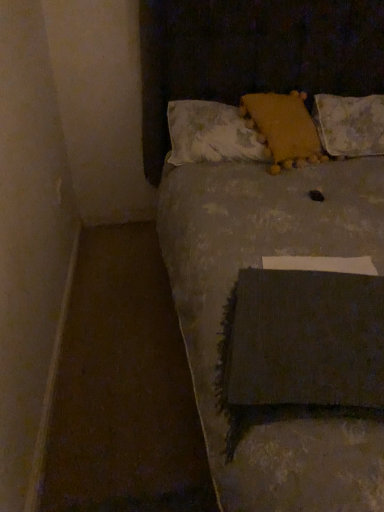
Question: From the image's perspective, would you say white textured pillow at upper right, the first pillow from the right, is shown under yellow fuzzy pillow at upper center, the second pillow when ordered from left to right?

Choices:
 (A) no
 (B) yes

Answer: (A)

Question: Is white textured pillow at upper right, the first pillow from the right, looking in the opposite direction of yellow fuzzy pillow at upper center, acting as the second pillow starting from the right?

Choices:
 (A) yes
 (B) no

Answer: (B)

Question: Is white textured pillow at upper right, the first pillow from the right, next to yellow fuzzy pillow at upper center, acting as the second pillow starting from the right?

Choices:
 (A) no
 (B) yes

Answer: (A)

Question: From a real-world perspective, is white textured pillow at upper right, the first pillow from the right, below yellow fuzzy pillow at upper center, the second pillow when ordered from left to right?

Choices:
 (A) no
 (B) yes

Answer: (B)

Question: Is yellow fuzzy pillow at upper center, the second pillow when ordered from left to right, located within white textured pillow at upper right, which is the third pillow in left-to-right order?

Choices:
 (A) yes
 (B) no

Answer: (B)

Question: From the image's perspective, is textured gray blanket at center positioned above or below fluffy white pillow at upper center, the 1th pillow when ordered from left to right?

Choices:
 (A) below
 (B) above

Answer: (A)

Question: Looking at the image, does textured gray blanket at center seem bigger or smaller compared to fluffy white pillow at upper center, the 1th pillow when ordered from left to right?

Choices:
 (A) small
 (B) big

Answer: (B)

Question: In terms of width, does textured gray blanket at center look wider or thinner when compared to fluffy white pillow at upper center, the 1th pillow when ordered from left to right?

Choices:
 (A) thin
 (B) wide

Answer: (B)

Question: Is point pyautogui.click(x=180, y=116) closer or farther from the camera than point pyautogui.click(x=200, y=138)?

Choices:
 (A) closer
 (B) farther

Answer: (B)

Question: Is fluffy white pillow at upper center, which ranks as the third pillow in right-to-left order, spatially inside white textured pillow at upper right, the first pillow from the right, or outside of it?

Choices:
 (A) outside
 (B) inside

Answer: (A)

Question: In terms of height, does fluffy white pillow at upper center, which ranks as the third pillow in right-to-left order, look taller or shorter compared to white textured pillow at upper right, the first pillow from the right?

Choices:
 (A) short
 (B) tall

Answer: (A)

Question: Looking at the image, does fluffy white pillow at upper center, which ranks as the third pillow in right-to-left order, seem bigger or smaller compared to white textured pillow at upper right, the first pillow from the right?

Choices:
 (A) big
 (B) small

Answer: (A)

Question: Looking at their shapes, would you say fluffy white pillow at upper center, which ranks as the third pillow in right-to-left order, is wider or thinner than white textured pillow at upper right, which is the third pillow in left-to-right order?

Choices:
 (A) wide
 (B) thin

Answer: (B)

Question: From a real-world perspective, relative to fluffy white pillow at upper center, the 1th pillow when ordered from left to right, is white textured pillow at upper right, which is the third pillow in left-to-right order, vertically above or below?

Choices:
 (A) below
 (B) above

Answer: (A)

Question: From the image's perspective, is white textured pillow at upper right, which is the third pillow in left-to-right order, positioned above or below fluffy white pillow at upper center, the 1th pillow when ordered from left to right?

Choices:
 (A) above
 (B) below

Answer: (A)